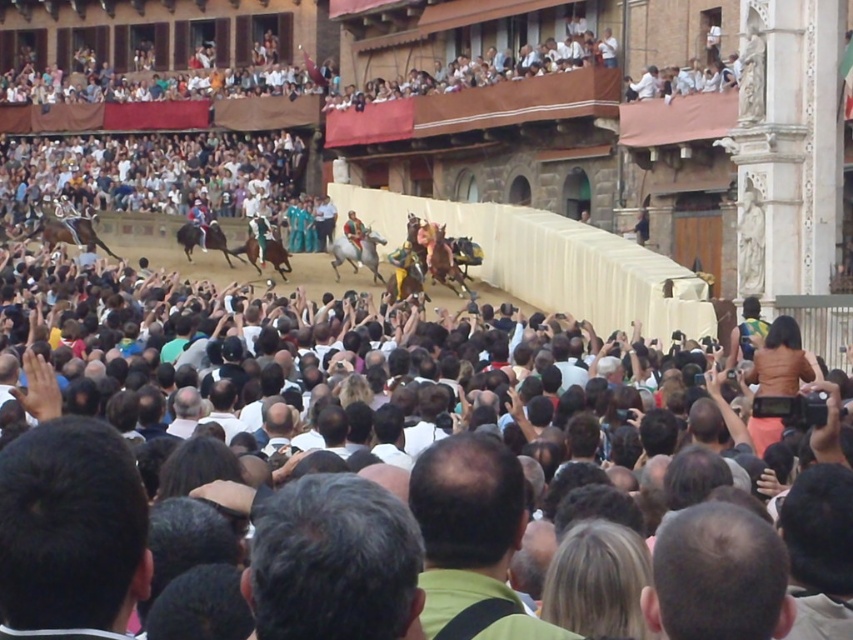
You are a photographer trying to capture the horse race action. You notice a point at coordinates (334, 563) in the image. What is located at that point?

The point at coordinates (334, 563) is located on gray hair at center.